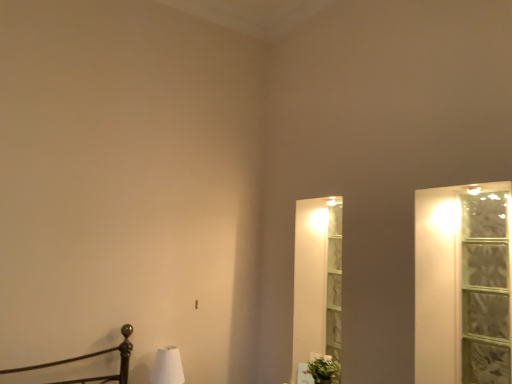
Locate an element on the screen. The width and height of the screenshot is (512, 384). free point above green leafy plant at lower right (from a real-world perspective) is located at coordinates (321, 364).